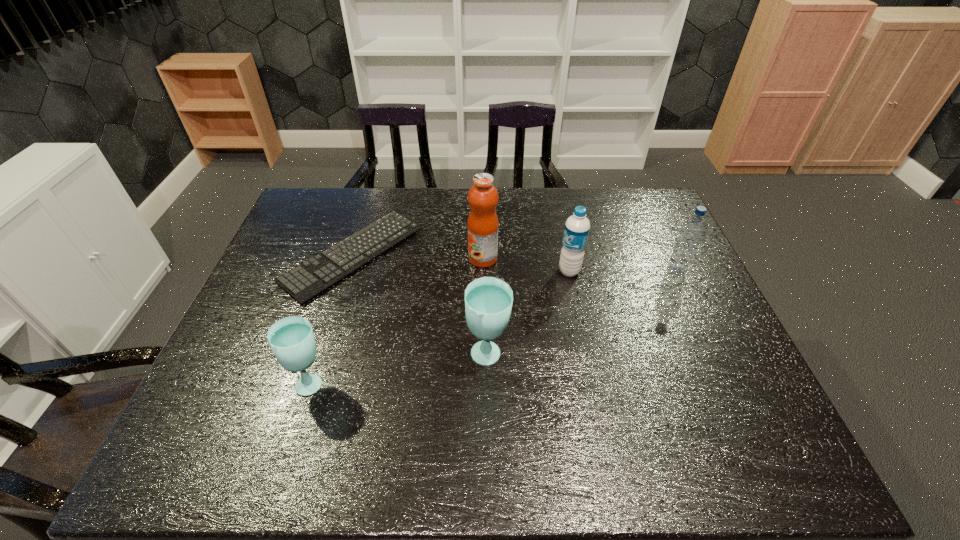
In order to click on object that is at the right edge in this screenshot , I will do `click(691, 233)`.

Identify the location of object that is at the far left corner. (303, 282).

You are a GUI agent. You are given a task and a screenshot of the screen. Output one action in this format:
    pyautogui.click(x=<x>, y=<y>)
    Task: Click on the vacant area at the far edge of the desktop
    The width and height of the screenshot is (960, 540).
    Given the screenshot: What is the action you would take?
    pyautogui.click(x=589, y=203)

Where is `vacant area at the near edge`? The height and width of the screenshot is (540, 960). vacant area at the near edge is located at coordinates (670, 409).

Find the location of a particular element. free space at the left edge of the desktop is located at coordinates (282, 237).

I want to click on vacant space at the right edge, so click(674, 291).

The width and height of the screenshot is (960, 540). In the image, there is a desktop. Identify the location of blank space at the far left corner. (306, 214).

This screenshot has width=960, height=540. Identify the location of vacant space at the near left corner of the desktop. (257, 417).

This screenshot has width=960, height=540. I want to click on free space at the far right corner, so [640, 223].

Find the location of a particular element. This screenshot has height=540, width=960. vacant space at the near right corner is located at coordinates (717, 413).